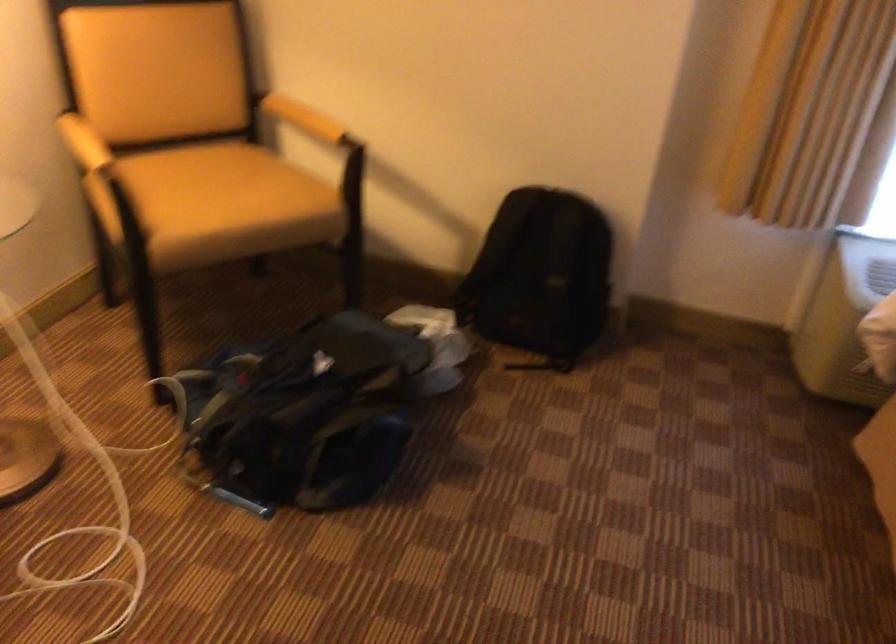
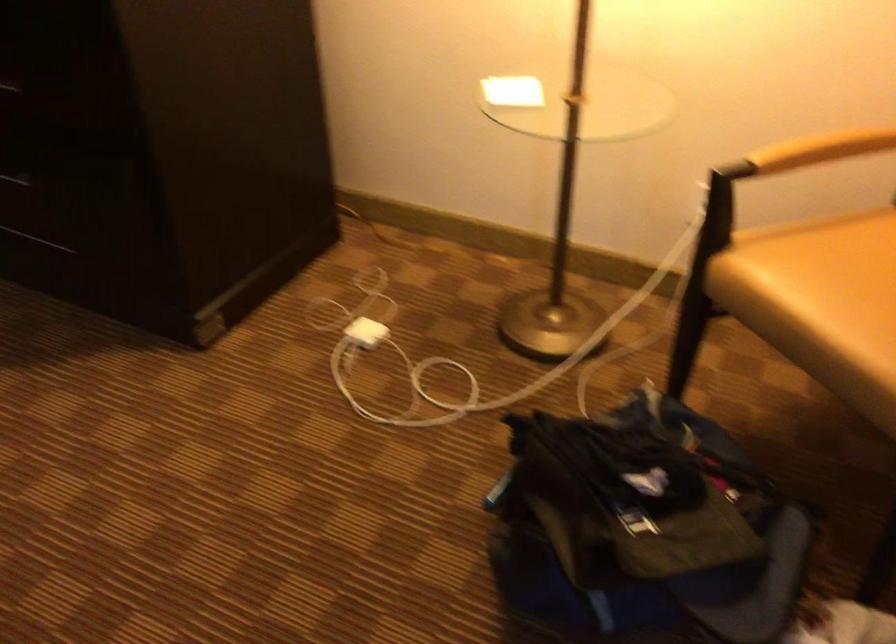
In the second image, find the point that corresponds to (252,210) in the first image.

(821, 303)